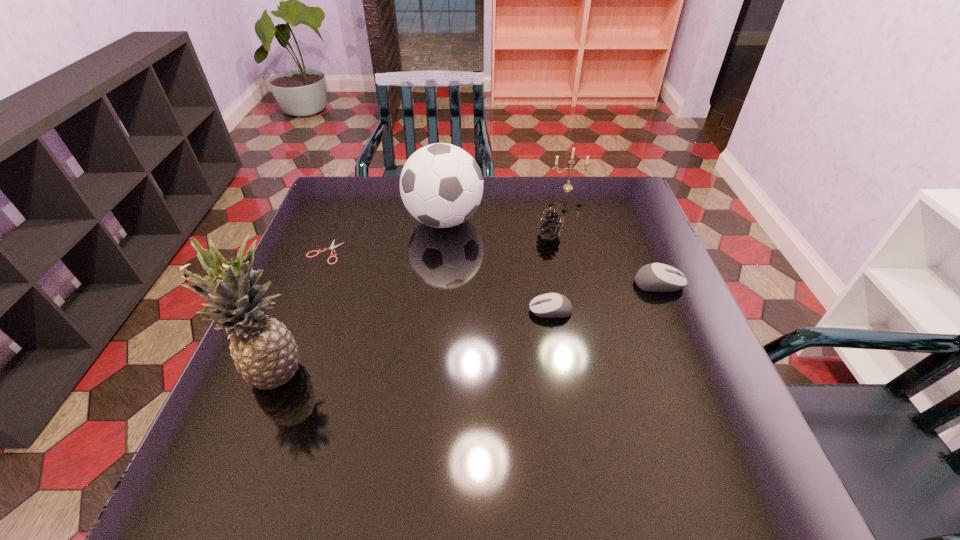
I want to click on free space between the farther computer equipment and the left computer equipment, so click(x=605, y=297).

Find the location of `unoccupied position between the tallest object and the third tallest object`. unoccupied position between the tallest object and the third tallest object is located at coordinates (420, 280).

Identify the location of free space between the pinecone and the right computer equipment. (604, 259).

You are a GUI agent. You are given a task and a screenshot of the screen. Output one action in this format:
    pyautogui.click(x=<x>, y=<y>)
    Task: Click on the free spot between the fourth tallest object and the shorter computer equipment
    The width and height of the screenshot is (960, 540).
    Given the screenshot: What is the action you would take?
    [550, 273]

Identify the location of free spot between the left computer equipment and the soccer ball. This screenshot has height=540, width=960. (497, 266).

Locate an element on the screen. the sixth closest object to the fifth shortest object is located at coordinates (265, 353).

What are the coordinates of `object that is the sixth closest one to the sixth shortest object` in the screenshot? It's located at (656, 277).